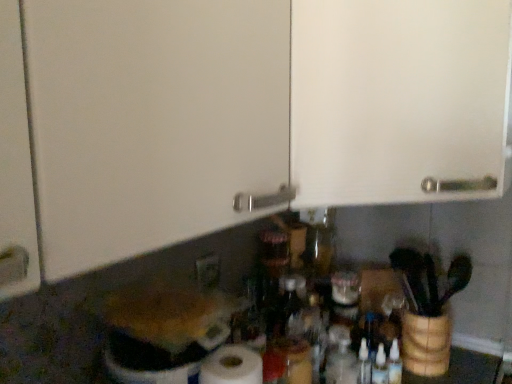
Question: From a real-world perspective, does matte white electric outlet at lower center stand above white matte cabinet door at upper center?

Choices:
 (A) yes
 (B) no

Answer: (B)

Question: Could you tell me if matte white electric outlet at lower center is turned towards white matte cabinet door at upper center?

Choices:
 (A) yes
 (B) no

Answer: (B)

Question: Is matte white electric outlet at lower center with white matte cabinet door at upper center?

Choices:
 (A) no
 (B) yes

Answer: (A)

Question: Is matte white electric outlet at lower center not near white matte cabinet door at upper center?

Choices:
 (A) yes
 (B) no

Answer: (B)

Question: Is matte white electric outlet at lower center to the right of white matte cabinet door at upper center from the viewer's perspective?

Choices:
 (A) no
 (B) yes

Answer: (A)

Question: Is matte white electric outlet at lower center to the left or to the right of white matte cabinet door at upper center in the image?

Choices:
 (A) left
 (B) right

Answer: (A)

Question: Is matte white electric outlet at lower center inside or outside of white matte cabinet door at upper center?

Choices:
 (A) outside
 (B) inside

Answer: (A)

Question: Is matte white electric outlet at lower center bigger or smaller than white matte cabinet door at upper center?

Choices:
 (A) big
 (B) small

Answer: (B)

Question: Looking at their shapes, would you say matte white electric outlet at lower center is wider or thinner than white matte cabinet door at upper center?

Choices:
 (A) thin
 (B) wide

Answer: (A)

Question: Which is correct: transparent plastic bottle at center is inside white matte paper towel at lower center, or outside of it?

Choices:
 (A) outside
 (B) inside

Answer: (A)

Question: Relative to white matte paper towel at lower center, is transparent plastic bottle at center in front or behind?

Choices:
 (A) front
 (B) behind

Answer: (B)

Question: From a real-world perspective, is transparent plastic bottle at center above or below white matte paper towel at lower center?

Choices:
 (A) above
 (B) below

Answer: (B)

Question: From their relative heights in the image, would you say transparent plastic bottle at center is taller or shorter than white matte paper towel at lower center?

Choices:
 (A) tall
 (B) short

Answer: (B)

Question: Looking at their shapes, would you say transparent plastic bottle at center is wider or thinner than white matte cabinet door at upper center?

Choices:
 (A) wide
 (B) thin

Answer: (B)

Question: From their relative heights in the image, would you say transparent plastic bottle at center is taller or shorter than white matte cabinet door at upper center?

Choices:
 (A) short
 (B) tall

Answer: (A)